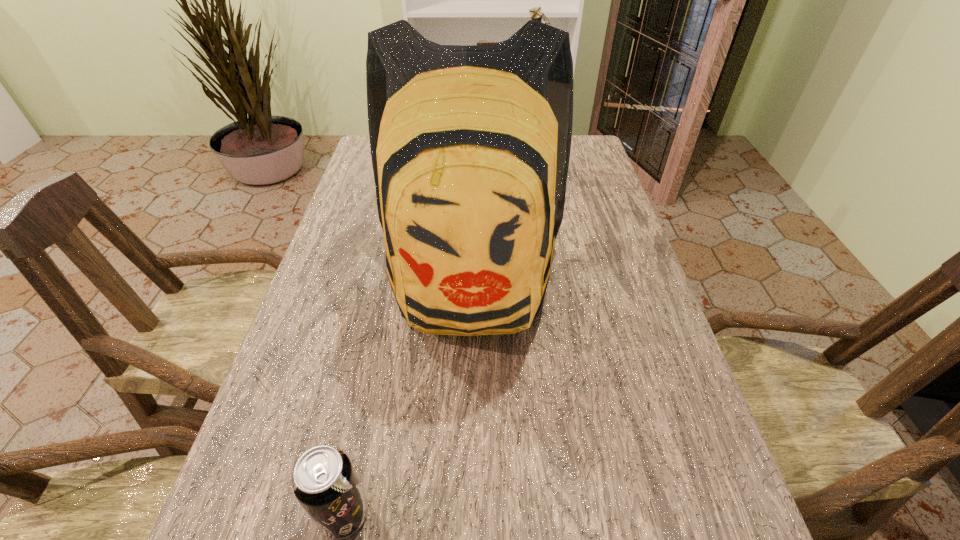
The width and height of the screenshot is (960, 540). In the image, there is a desktop. In order to click on vacant space at the left edge in this screenshot , I will do `click(358, 191)`.

Image resolution: width=960 pixels, height=540 pixels. In the image, there is a desktop. Identify the location of free space at the right edge. (677, 442).

The height and width of the screenshot is (540, 960). Find the location of `free space at the far left corner of the desktop`. free space at the far left corner of the desktop is located at coordinates (362, 167).

Find the location of a particular element. This screenshot has height=540, width=960. object that stands as the closest to the second nearest object is located at coordinates pyautogui.click(x=536, y=13).

Identify the location of object that is the closest to the second nearest object. (536, 13).

Locate an element on the screen. This screenshot has width=960, height=540. vacant region that satisfies the following two spatial constraints: 1. on the front-facing side of the farthest object; 2. on the front-facing side of the backpack is located at coordinates (549, 275).

Locate an element on the screen. free space that satisfies the following two spatial constraints: 1. on the front-facing side of the sculpture; 2. on the front-facing side of the second nearest object is located at coordinates (549, 275).